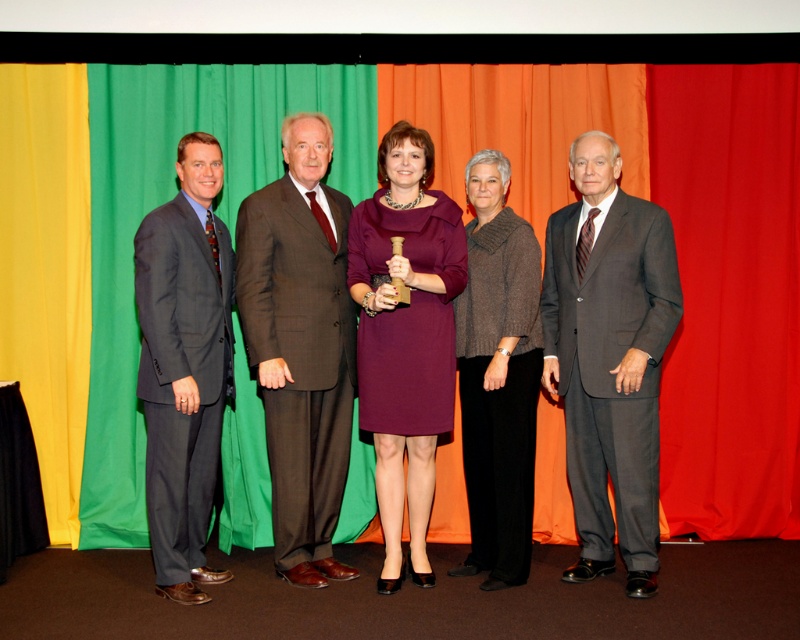
Question: Does dark gray suit at center appear on the right side of brown wool suit at center?

Choices:
 (A) yes
 (B) no

Answer: (A)

Question: Which of the following is the farthest from the observer?

Choices:
 (A) (156, 291)
 (B) (410, 332)
 (C) (608, 456)
 (D) (334, 512)

Answer: (D)

Question: Does brown wool suit at center appear on the right side of purple satin dress at center?

Choices:
 (A) no
 (B) yes

Answer: (A)

Question: Which point appears closest to the camera in this image?

Choices:
 (A) (502, 444)
 (B) (398, 396)

Answer: (B)

Question: Which of these objects is positioned closest to the dark gray suit at center?

Choices:
 (A) brown woolen sweater at center
 (B) purple satin dress at center
 (C) dark gray suit at left
 (D) brown wool suit at center

Answer: (A)

Question: Is dark gray suit at center to the right of brown wool suit at center from the viewer's perspective?

Choices:
 (A) no
 (B) yes

Answer: (B)